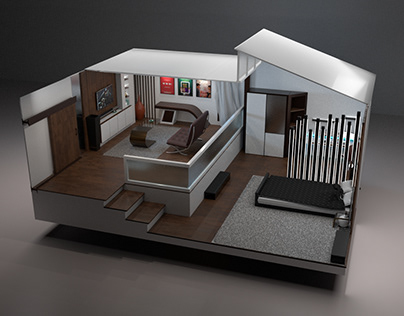
Identify the location of steps. The width and height of the screenshot is (404, 316). (149, 210), (129, 197).